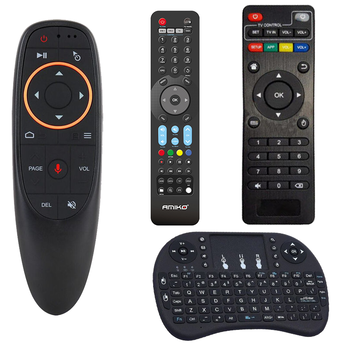
Locate an element on the screen. remote control is located at coordinates (66, 183), (175, 137), (267, 121), (244, 273).